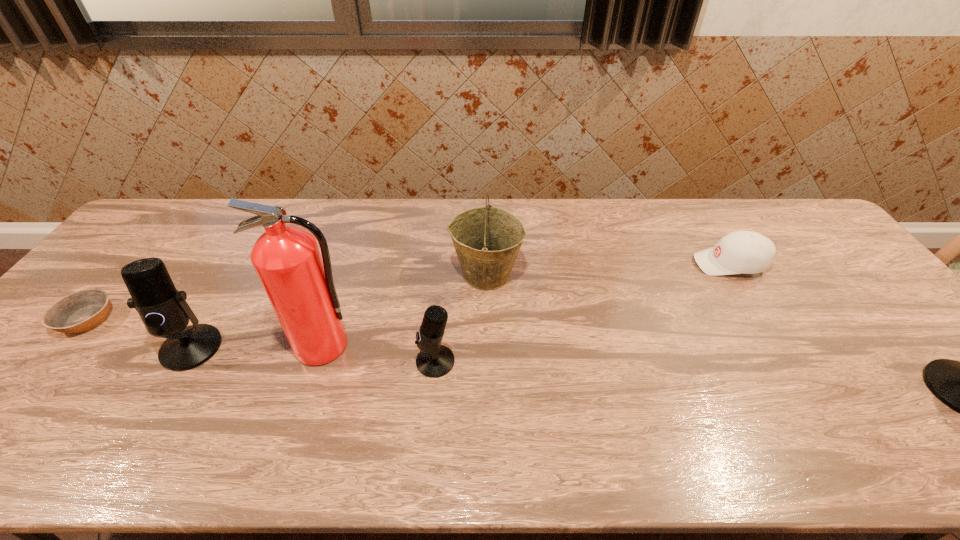
The width and height of the screenshot is (960, 540). In order to click on vacant region located at the nozzle of the fifth object from right to left in this screenshot , I will do `click(302, 412)`.

Find the location of a particular element. object that is at the left edge is located at coordinates (80, 311).

In the image, there is a desktop. Identify the location of vacant space at the far edge. Image resolution: width=960 pixels, height=540 pixels. (339, 212).

Locate an element on the screen. This screenshot has width=960, height=540. free location at the left edge of the desktop is located at coordinates (128, 245).

Locate an element on the screen. free spot at the right edge of the desktop is located at coordinates (810, 255).

In the image, there is a desktop. At what (x,y) coordinates should I click in order to perform the action: click on free space at the far left corner. Please return your answer as a coordinate pair (x, y). Looking at the image, I should click on (146, 224).

At what (x,y) coordinates should I click in order to perform the action: click on empty space that is in between the fifth object from right to left and the baseball cap. Please return your answer as a coordinate pair (x, y). The width and height of the screenshot is (960, 540). Looking at the image, I should click on (526, 305).

Locate an element on the screen. The image size is (960, 540). free point between the fire extinguisher and the wine bucket is located at coordinates (405, 310).

The image size is (960, 540). I want to click on vacant area that lies between the second object from right to left and the third shortest object, so click(583, 313).

You are a GUI agent. You are given a task and a screenshot of the screen. Output one action in this format:
    pyautogui.click(x=<x>, y=<y>)
    Task: Click on the unoccupied area between the second microphone from left to right and the second object from right to left
    This screenshot has height=540, width=960.
    Given the screenshot: What is the action you would take?
    pyautogui.click(x=583, y=313)